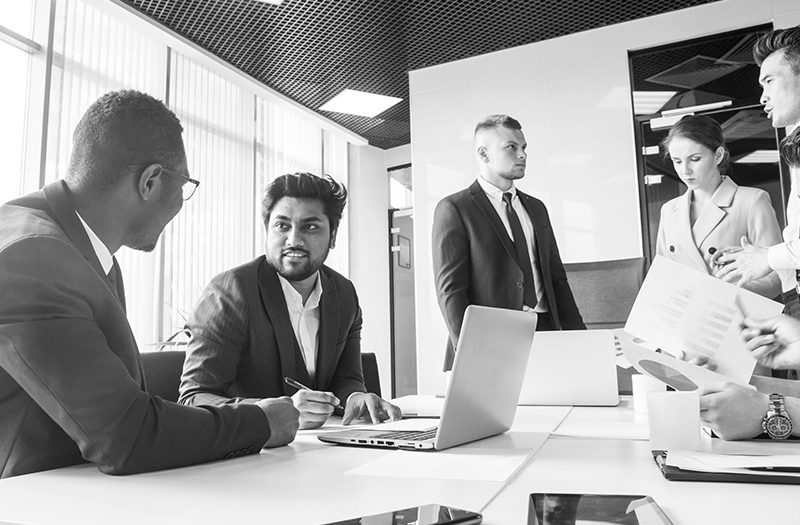
You are a GUI agent. You are given a task and a screenshot of the screen. Output one action in this format:
    pyautogui.click(x=<x>, y=<y>)
    Task: Click on the white wall
    This screenshot has height=525, width=800.
    Given the screenshot: What is the action you would take?
    pyautogui.click(x=586, y=136)